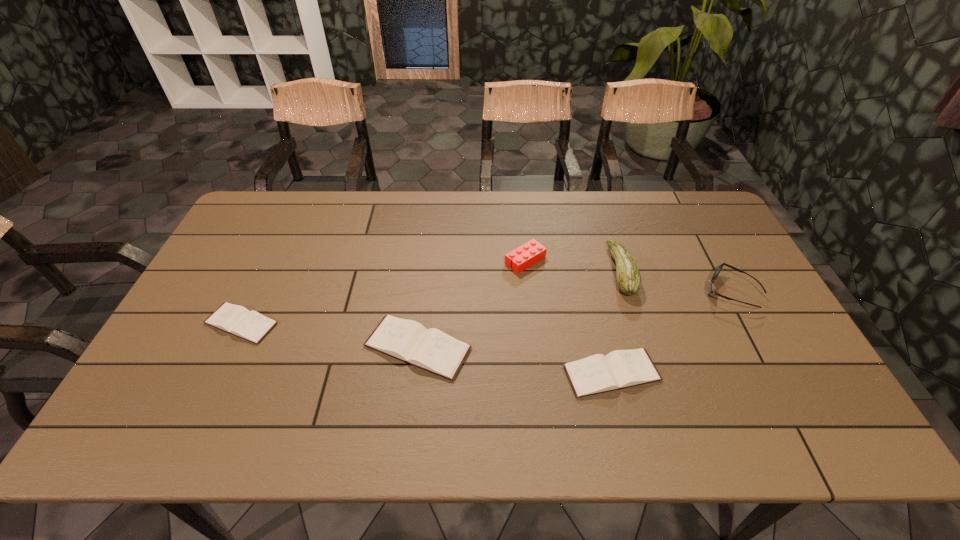
In order to click on free region at the far edge of the desktop in this screenshot , I will do `click(621, 197)`.

In order to click on free space at the near edge in this screenshot , I will do `click(643, 396)`.

Locate an element on the screen. blank space at the left edge is located at coordinates (251, 238).

Find the location of a particular element. The width and height of the screenshot is (960, 540). free spot at the right edge of the desktop is located at coordinates (765, 329).

Where is `free spot at the far left corner of the desktop`? The height and width of the screenshot is (540, 960). free spot at the far left corner of the desktop is located at coordinates (246, 233).

The height and width of the screenshot is (540, 960). What are the coordinates of `free space at the far right corner of the desktop` in the screenshot? It's located at (673, 219).

In the image, there is a desktop. In order to click on blank space at the near right corner in this screenshot , I will do `click(764, 374)`.

This screenshot has height=540, width=960. In order to click on unoccupied position between the Lego and the tallest object in this screenshot , I will do `click(573, 266)`.

I want to click on vacant point located between the leftmost diary and the fifth object from right to left, so click(329, 335).

Image resolution: width=960 pixels, height=540 pixels. What are the coordinates of `free spot between the fourth object from right to left and the leftmost object` in the screenshot? It's located at (383, 292).